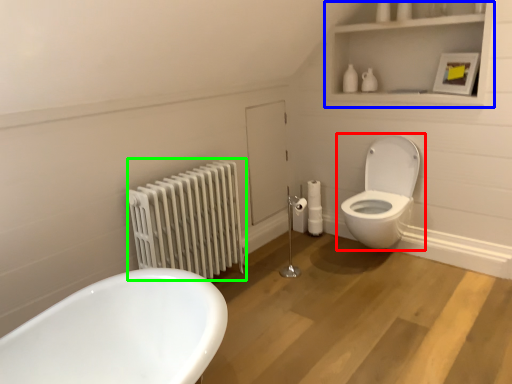
Question: Estimate the real-world distances between objects in this image. Which object is closer to toilet (highlighted by a red box), medicine cabinet (highlighted by a blue box) or radiator (highlighted by a green box)?

Choices:
 (A) medicine cabinet
 (B) radiator

Answer: (A)